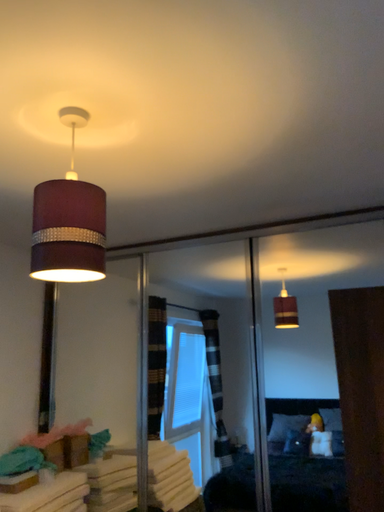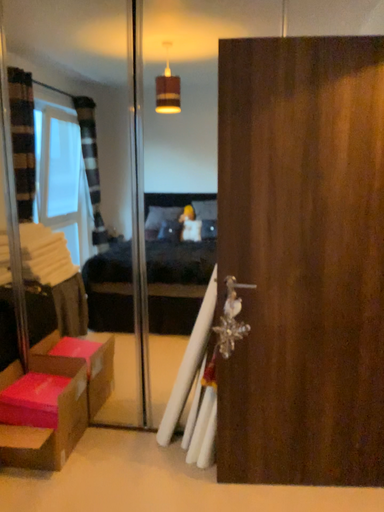
Question: How did the camera likely rotate when shooting the video?

Choices:
 (A) rotated right
 (B) rotated left

Answer: (A)